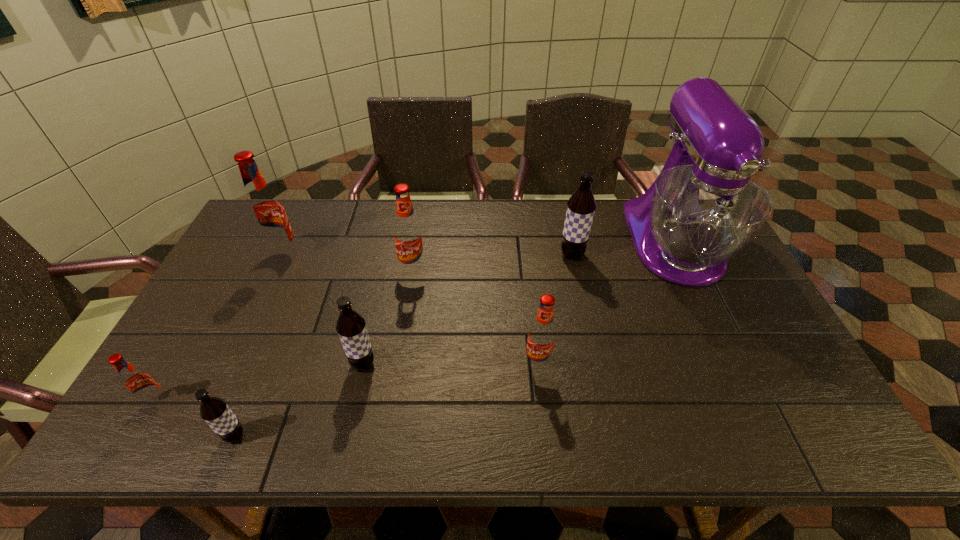
You are a GUI agent. You are given a task and a screenshot of the screen. Output one action in this format:
    pyautogui.click(x=<x>, y=<y>)
    Task: Click on the vacant region at the left edge of the desktop
    
    Given the screenshot: What is the action you would take?
    pyautogui.click(x=182, y=382)

Locate an element on the screen. This screenshot has height=540, width=960. blank region between the third farthest red root beer and the biggest brown root beer is located at coordinates (555, 309).

Where is `free space between the nearest root beer and the purple mixer`? The height and width of the screenshot is (540, 960). free space between the nearest root beer and the purple mixer is located at coordinates pyautogui.click(x=455, y=339).

This screenshot has width=960, height=540. Identify the location of vacant area between the leftmost brown root beer and the leftmost root beer. (196, 419).

Where is `vacant space that's between the tallest root beer and the leftmost root beer`? vacant space that's between the tallest root beer and the leftmost root beer is located at coordinates click(x=221, y=329).

This screenshot has height=540, width=960. What are the coordinates of `free spot between the third red root beer from right to left and the fourth root beer from right to left` in the screenshot? It's located at (324, 310).

Where is `unoccupied position between the sixth root beer from left to right and the rightmost root beer`? The image size is (960, 540). unoccupied position between the sixth root beer from left to right and the rightmost root beer is located at coordinates click(x=555, y=309).

Where is `vacant area that lies between the sixth object from right to left and the rightmost object`? This screenshot has width=960, height=540. vacant area that lies between the sixth object from right to left and the rightmost object is located at coordinates (455, 339).

At what (x,y) coordinates should I click in order to perform the action: click on blank region between the fifth object from right to left and the purple mixer. Please return your answer as a coordinate pair (x, y). The image size is (960, 540). Looking at the image, I should click on (518, 303).

Where is `free area in between the second brown root beer from right to left and the rightmost root beer`? free area in between the second brown root beer from right to left and the rightmost root beer is located at coordinates (468, 310).